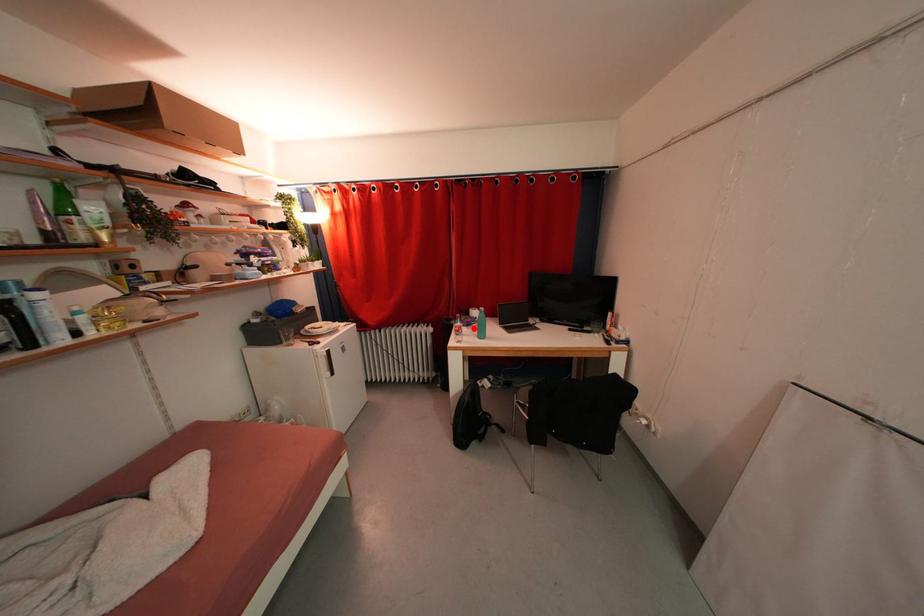
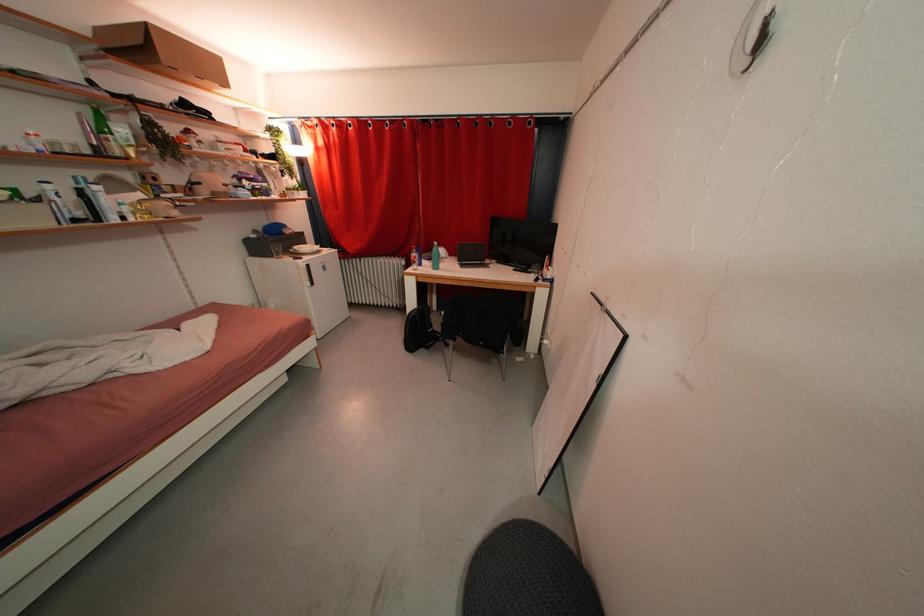
The point at the highlighted location is marked in the first image. Where is the corresponding point in the second image?

(435, 262)